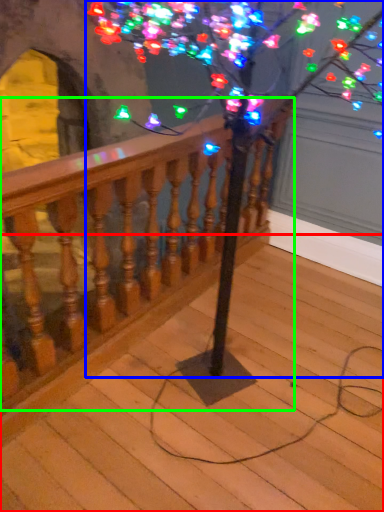
Question: Considering the real-world distances, which object is closest to stairs (highlighted by a red box)? tree (highlighted by a blue box) or rail (highlighted by a green box).

Choices:
 (A) tree
 (B) rail

Answer: (B)